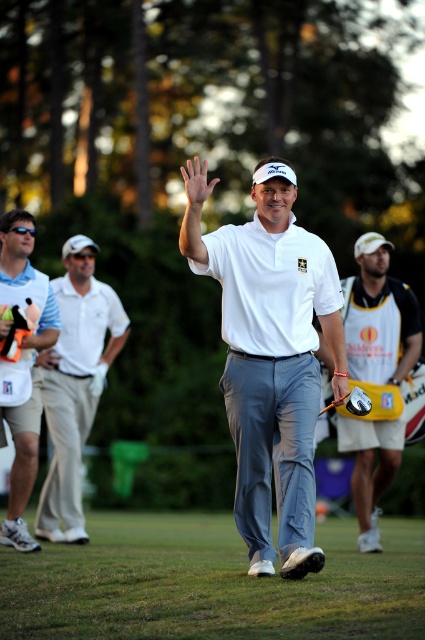
The width and height of the screenshot is (425, 640). What do you see at coordinates (269, 358) in the screenshot?
I see `white matte shirt at center` at bounding box center [269, 358].

Which of these two, white matte shirt at center or matte white polo shirt at left, stands taller?

matte white polo shirt at left

Find the location of a particular element. The height and width of the screenshot is (640, 425). white matte shirt at center is located at coordinates (269, 358).

Is point (51, 529) behind point (31, 544)?

Yes, it is behind point (31, 544).

The height and width of the screenshot is (640, 425). Describe the element at coordinates (74, 384) in the screenshot. I see `white cotton polo shirt at left` at that location.

Who is more distant from viewer, (48, 477) or (17, 252)?

The point (48, 477) is behind.

The width and height of the screenshot is (425, 640). I want to click on white cotton polo shirt at left, so click(x=74, y=384).

In the scene shown: Is gray fabric pants at lower center closer to the viewer compared to white cotton polo shirt at left?

Yes, gray fabric pants at lower center is closer to the viewer.

Who is more distant from viewer, (339, 557) or (71, 477)?

Point (71, 477)

Identify the location of gray fabric pants at lower center. The width and height of the screenshot is (425, 640). (209, 584).